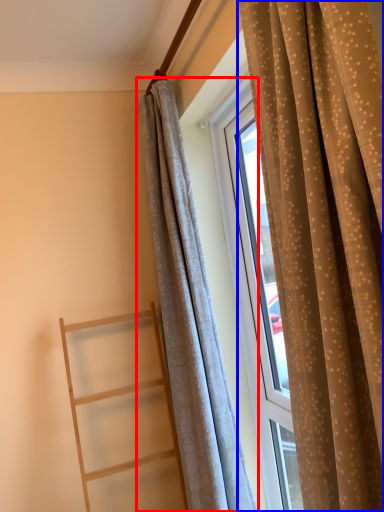
Question: Which object appears closest to the camera in this image, curtain (highlighted by a red box) or curtain (highlighted by a blue box)?

Choices:
 (A) curtain
 (B) curtain

Answer: (B)